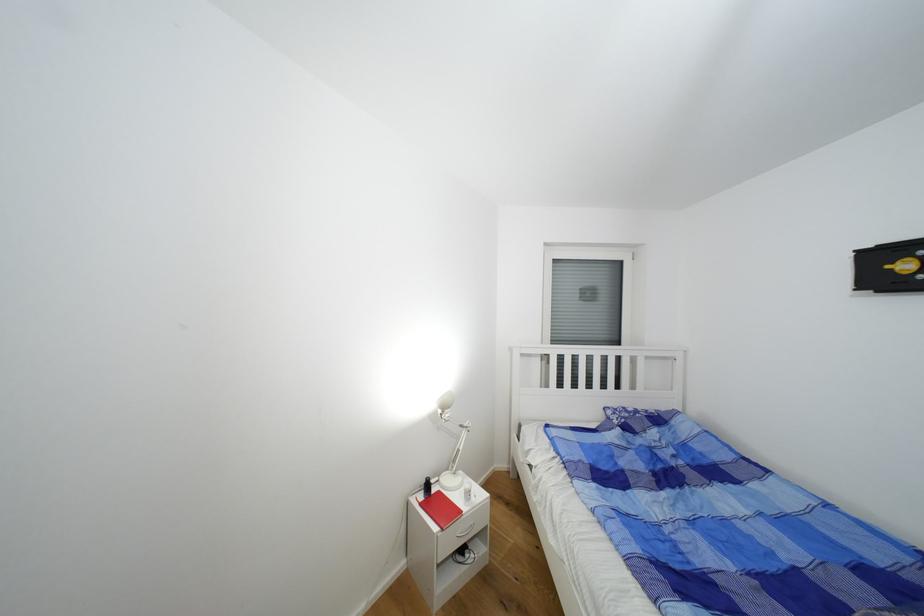
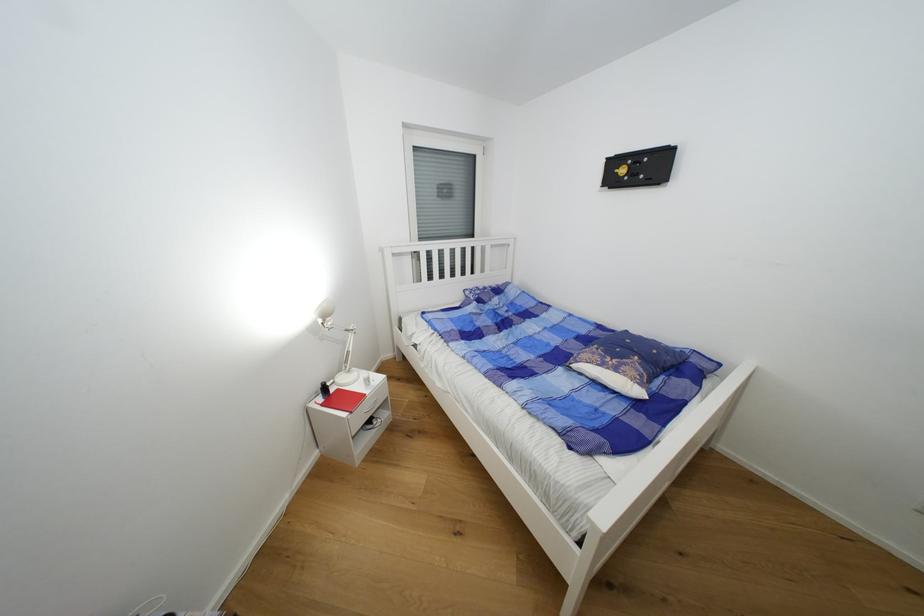
Locate, in the second image, the point that corresponds to point (444, 413) in the first image.

(325, 323)